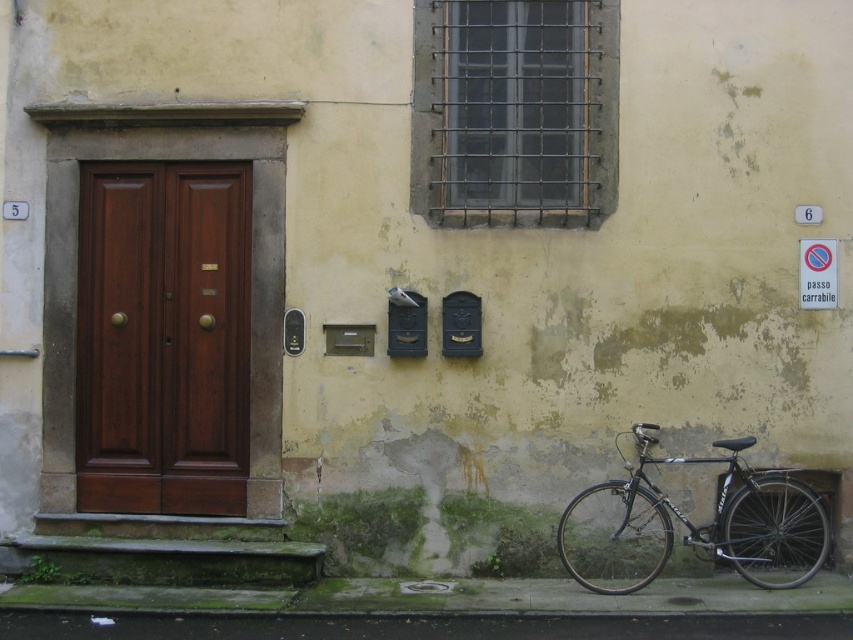
Question: Observing the image, what is the correct spatial positioning of shiny black bike at lower right in reference to blue plastic sign at upper right?

Choices:
 (A) right
 (B) left

Answer: (B)

Question: Which point is farther from the camera taking this photo?

Choices:
 (A) (158, 508)
 (B) (817, 266)
 (C) (637, 440)

Answer: (A)

Question: Which object is positioned farthest from the mahogany wood door at left?

Choices:
 (A) shiny black bike at lower right
 (B) blue plastic sign at upper right

Answer: (B)

Question: Which point is farther to the camera?

Choices:
 (A) (142, 172)
 (B) (816, 276)
 (C) (582, 538)

Answer: (A)

Question: Is mahogany wood door at left to the right of shiny black bike at lower right from the viewer's perspective?

Choices:
 (A) yes
 (B) no

Answer: (B)

Question: Is mahogany wood door at left bigger than shiny black bike at lower right?

Choices:
 (A) yes
 (B) no

Answer: (B)